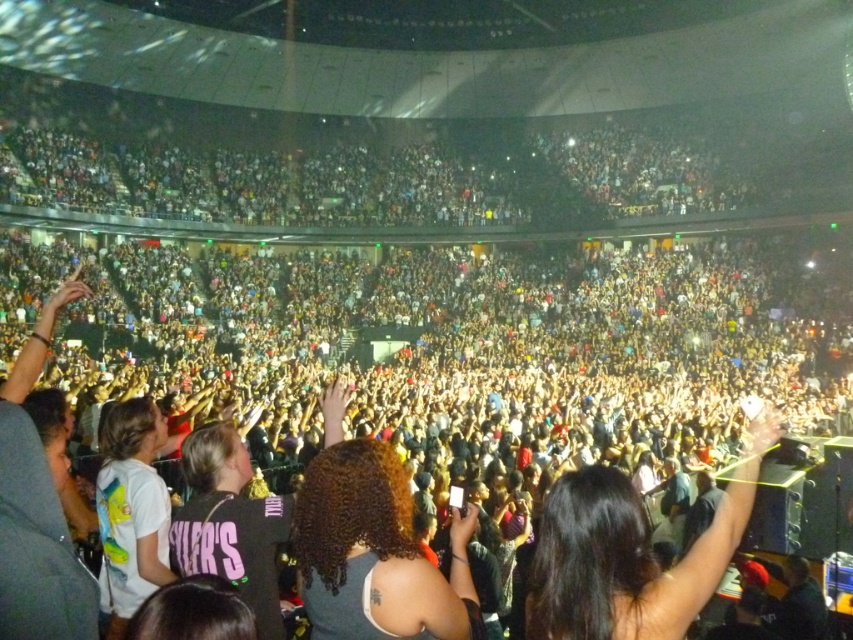
Question: Which point is closer to the camera taking this photo?

Choices:
 (A) (686, 586)
 (B) (142, 572)

Answer: (A)

Question: Is black hair at center to the right of curly hair at center from the viewer's perspective?

Choices:
 (A) yes
 (B) no

Answer: (A)

Question: Which point is farther to the camera?

Choices:
 (A) black hair at center
 (B) white matte t-shirt at lower left

Answer: (B)

Question: Observing the image, what is the correct spatial positioning of black hair at center in reference to white matte t-shirt at lower left?

Choices:
 (A) left
 (B) right

Answer: (B)

Question: Does black hair at center have a lesser width compared to curly hair at center?

Choices:
 (A) yes
 (B) no

Answer: (B)

Question: Which object is farther from the camera taking this photo?

Choices:
 (A) curly hair at center
 (B) white matte t-shirt at lower left
 (C) black hair at center

Answer: (B)